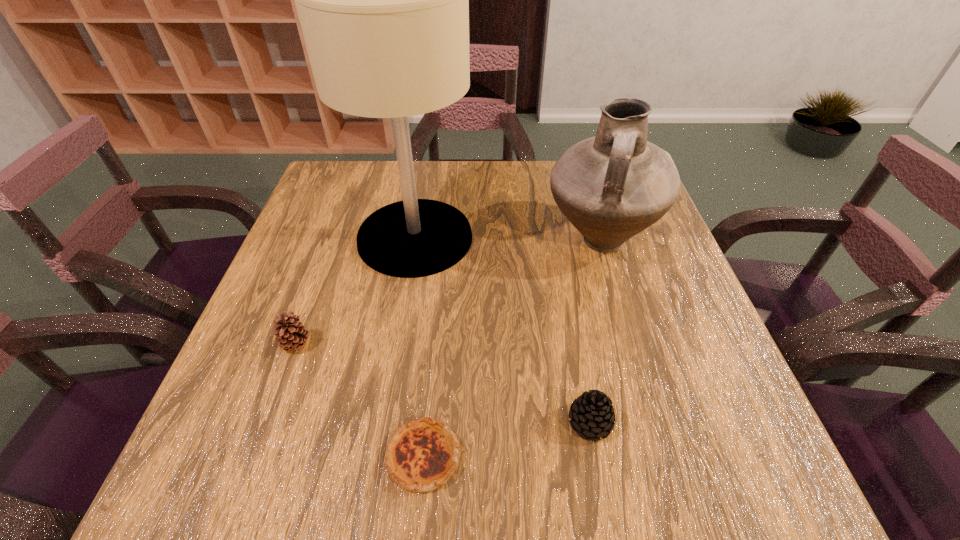
What are the coordinates of `free location at the far edge` in the screenshot? It's located at (540, 190).

The height and width of the screenshot is (540, 960). What are the coordinates of `vacant space at the near edge` in the screenshot? It's located at (488, 445).

At what (x,y) coordinates should I click in order to perform the action: click on vacant space at the left edge of the desktop. Please return your answer as a coordinate pair (x, y). Looking at the image, I should click on click(x=336, y=228).

In the image, there is a desktop. Where is `vacant space at the far left corner`? This screenshot has height=540, width=960. vacant space at the far left corner is located at coordinates (373, 178).

Locate an element on the screen. This screenshot has height=540, width=960. vacant region between the pitcher and the tallest object is located at coordinates (507, 239).

I want to click on vacant space that is in between the farther pinecone and the table lamp, so click(x=356, y=291).

This screenshot has width=960, height=540. Identify the location of vacant space that is in between the farther pinecone and the shortest object. (360, 400).

Image resolution: width=960 pixels, height=540 pixels. What are the coordinates of `vacant region between the quiche and the left pinecone` in the screenshot? It's located at (360, 400).

Find the location of a particular element. vacant area that lies between the table lamp and the leftmost object is located at coordinates (356, 291).

The width and height of the screenshot is (960, 540). Find the location of `free space between the right pinecone and the tallest object`. free space between the right pinecone and the tallest object is located at coordinates (502, 330).